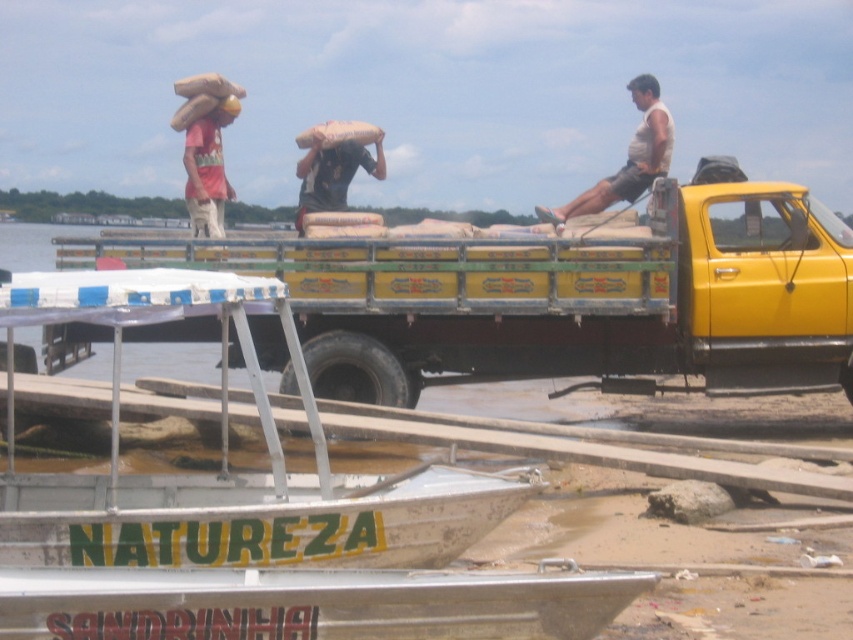
Question: Among these points, which one is farthest from the camera?

Choices:
 (A) (270, 534)
 (B) (233, 189)
 (C) (585, 198)
 (D) (366, 164)

Answer: (B)

Question: Does white plastic boat at lower left appear on the left side of matte red t-shirt at upper left?

Choices:
 (A) no
 (B) yes

Answer: (A)

Question: Does white plastic boat at lower left have a greater width compared to matte red t-shirt at upper left?

Choices:
 (A) yes
 (B) no

Answer: (A)

Question: Observing the image, what is the correct spatial positioning of white cotton shirt at upper right in reference to matte red t-shirt at upper left?

Choices:
 (A) above
 (B) below

Answer: (A)

Question: Which point appears farthest from the camera in this image?

Choices:
 (A) (368, 371)
 (B) (218, 163)
 (C) (641, 132)

Answer: (B)

Question: Which object is closer to the camera taking this photo?

Choices:
 (A) white cotton shirt at upper right
 (B) white plastic boat at lower left

Answer: (B)